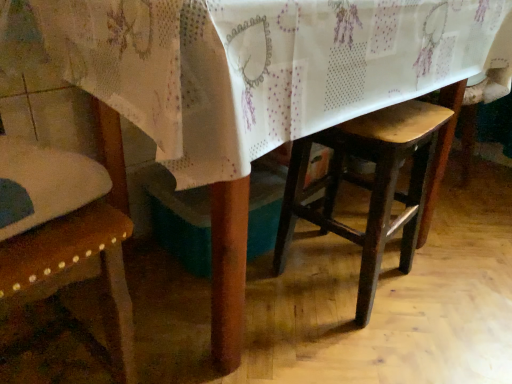
This screenshot has width=512, height=384. I want to click on empty space that is ontop of wooden stool at center (from a real-world perspective), so [396, 114].